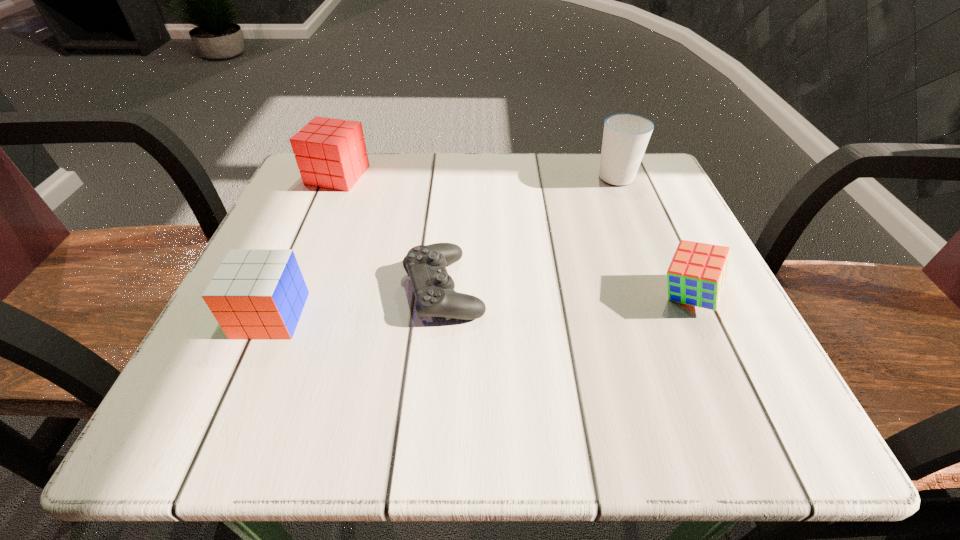
Where is `cube that is the closest one to the rightmost cube`? The height and width of the screenshot is (540, 960). cube that is the closest one to the rightmost cube is located at coordinates (255, 294).

The image size is (960, 540). In order to click on vacant region that satisfies the following two spatial constraints: 1. on the front side of the control; 2. on the right side of the farthest cube in this screenshot , I will do `click(290, 288)`.

Image resolution: width=960 pixels, height=540 pixels. Find the location of `vacant region that satisfies the following two spatial constraints: 1. on the front side of the farthest cube; 2. on the left side of the control`. vacant region that satisfies the following two spatial constraints: 1. on the front side of the farthest cube; 2. on the left side of the control is located at coordinates (290, 288).